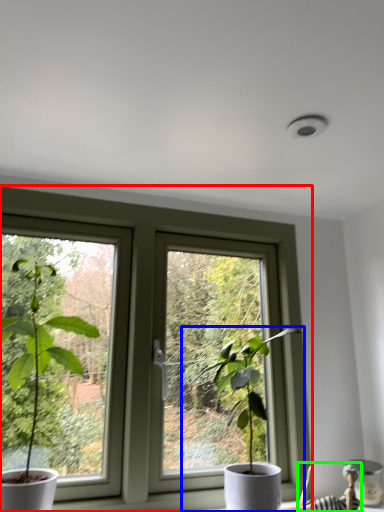
Question: Which object is positioned farthest from window (highlighted by a red box)? Select from houseplant (highlighted by a blue box) and couple (highlighted by a green box).

Choices:
 (A) houseplant
 (B) couple

Answer: (B)